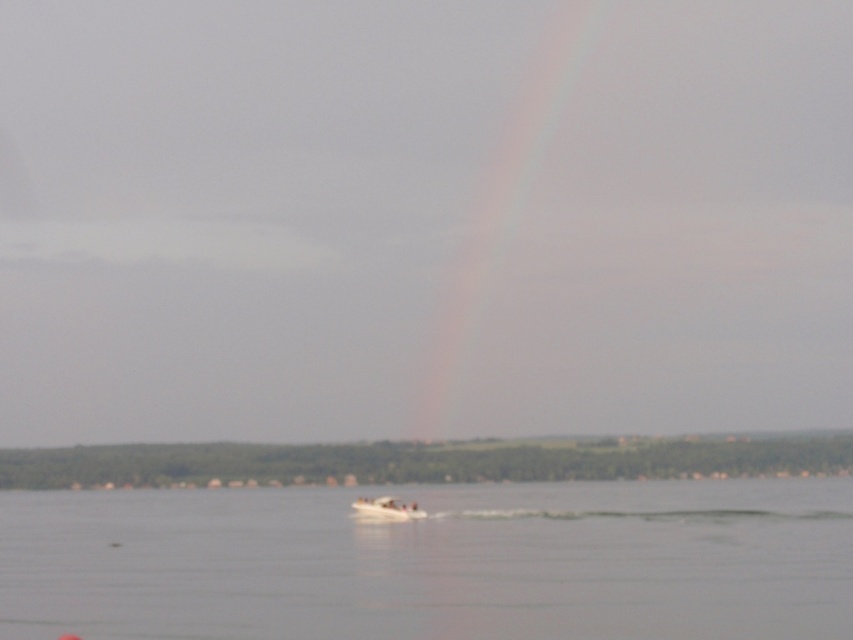
Question: From the image, what is the correct spatial relationship of clear water at lower center in relation to rainbow at center?

Choices:
 (A) right
 (B) left

Answer: (B)

Question: Can you confirm if clear water at lower center is wider than white plastic boat at center?

Choices:
 (A) yes
 (B) no

Answer: (A)

Question: Observing the image, what is the correct spatial positioning of clear water at lower center in reference to white plastic boat at center?

Choices:
 (A) right
 (B) left

Answer: (A)

Question: Which point is farther to the camera?

Choices:
 (A) clear water at lower center
 (B) rainbow at center

Answer: (B)

Question: Which point appears farthest from the camera in this image?

Choices:
 (A) (393, 506)
 (B) (839, 538)

Answer: (A)

Question: Among these objects, which one is farthest from the camera?

Choices:
 (A) rainbow at center
 (B) clear water at lower center
 (C) white plastic boat at center

Answer: (A)